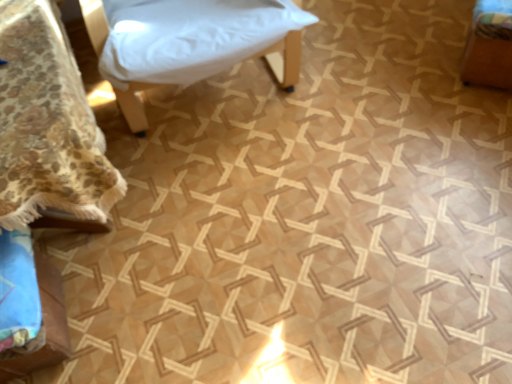
Find the location of a particular element. vacant space to the right of blue fabric cushion at lower left, the 3th furniture from the right is located at coordinates (133, 311).